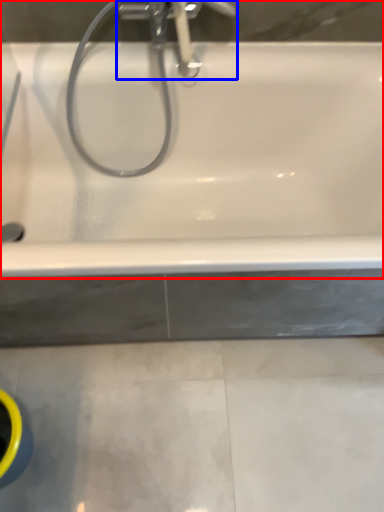
Question: Which point is closer to the camera, bathtub (highlighted by a red box) or tap (highlighted by a blue box)?

Choices:
 (A) bathtub
 (B) tap

Answer: (A)